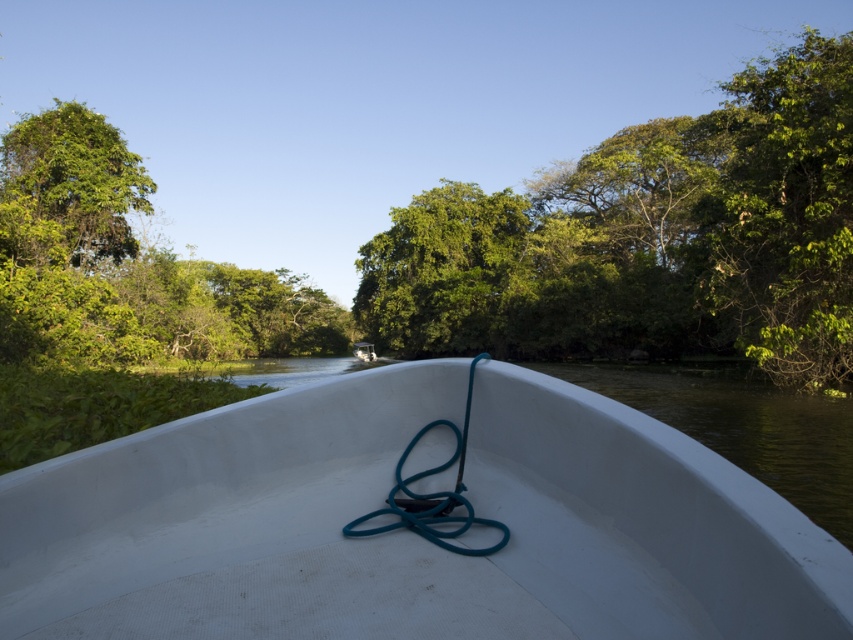
Question: Estimate the real-world distances between objects in this image. Which object is farther from the white matte boat at center?

Choices:
 (A) green leafy trees at center
 (B) green leafy tree at right
 (C) green leafy tree at upper left
 (D) teal rubber rope at center

Answer: (D)

Question: Which point is farther to the camera?

Choices:
 (A) green leafy tree at upper left
 (B) white matte boat at center
 (C) green leafy trees at center

Answer: (B)

Question: Is green leafy tree at upper left below teal rubber rope at center?

Choices:
 (A) yes
 (B) no

Answer: (B)

Question: Which of the following is the farthest from the observer?

Choices:
 (A) green leafy tree at right
 (B) green leafy trees at center

Answer: (B)

Question: Does green leafy trees at center come behind green leafy tree at right?

Choices:
 (A) no
 (B) yes

Answer: (B)

Question: Is green leafy tree at upper left smaller than teal rubber rope at center?

Choices:
 (A) no
 (B) yes

Answer: (A)